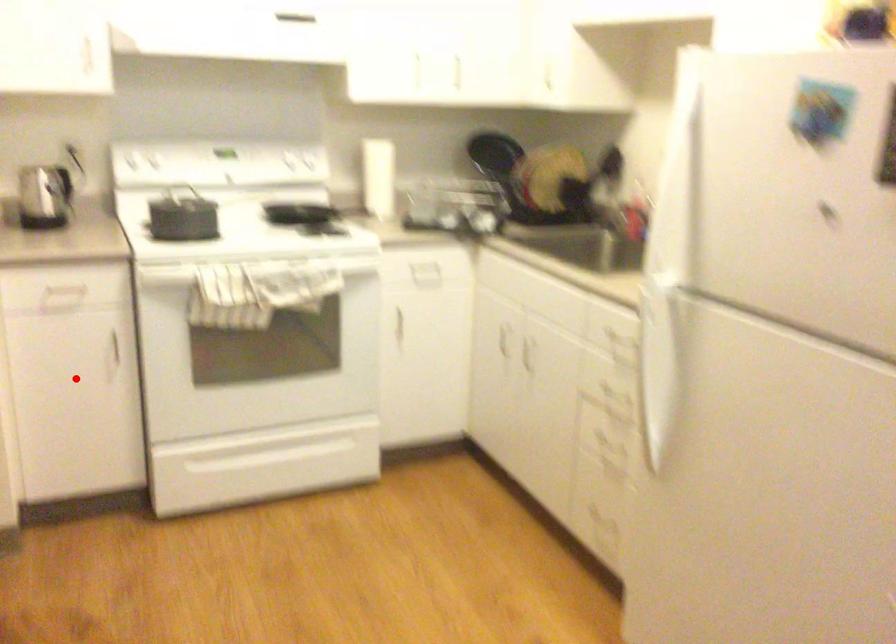
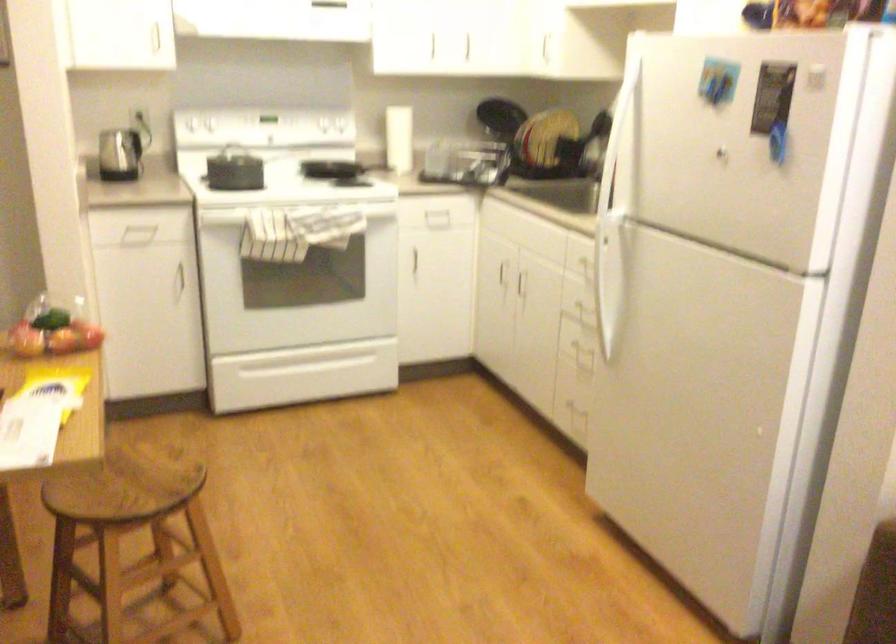
Question: I am providing you with two images of the same scene from different viewpoints. Given a red point in image1, look at the same physical point in image2. Is it:

Choices:
 (A) Closer to the viewpoint
 (B) Farther from the viewpoint

Answer: (B)